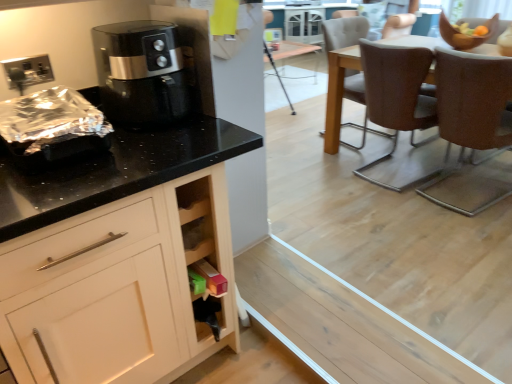
You are a GUI agent. You are given a task and a screenshot of the screen. Output one action in this format:
    pyautogui.click(x=<x>, y=<y>)
    Task: Click on the free spot below brown textured chair at right, placed as the third chair when sorted from front to back (from a real-world perspective)
    
    Given the screenshot: What is the action you would take?
    pyautogui.click(x=358, y=133)